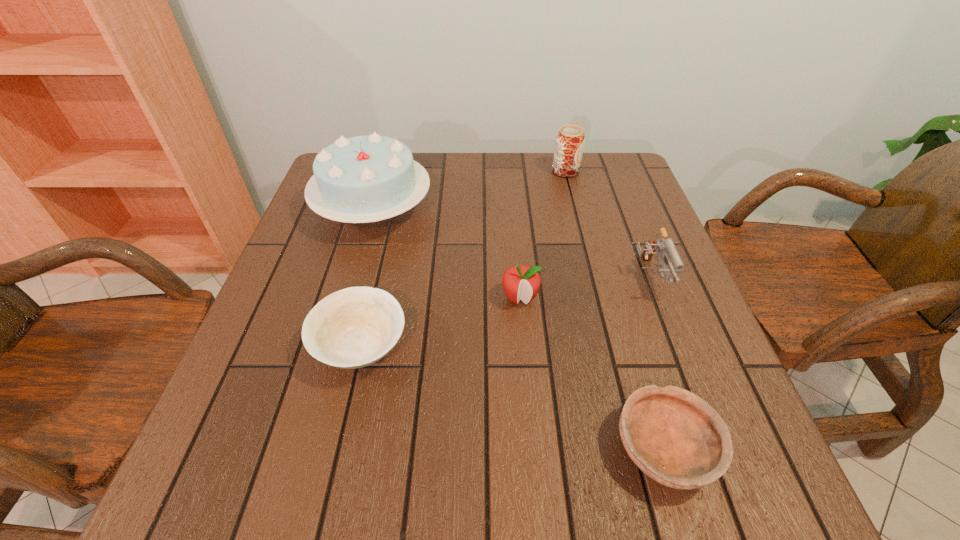
This screenshot has width=960, height=540. What are the coordinates of `free spot between the beer can and the apple` in the screenshot? It's located at 542,235.

The width and height of the screenshot is (960, 540). In order to click on object that can be found as the second closest to the fourth object from right to left in this screenshot , I will do `click(666, 247)`.

What are the coordinates of `object that is the closest to the nearest object` in the screenshot? It's located at (522, 282).